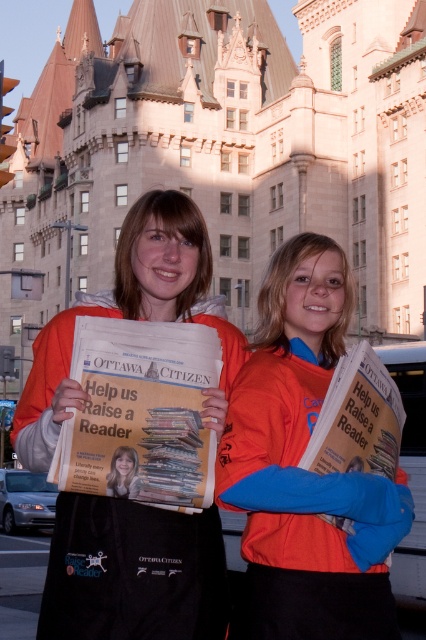
Does orange fabric jacket at center lie behind orange fleece jacket at center?

Yes, orange fabric jacket at center is further from the viewer.

Can you confirm if orange fabric jacket at center is positioned to the right of orange fleece jacket at center?

Yes, orange fabric jacket at center is to the right of orange fleece jacket at center.

I want to click on orange fabric jacket at center, so click(x=305, y=468).